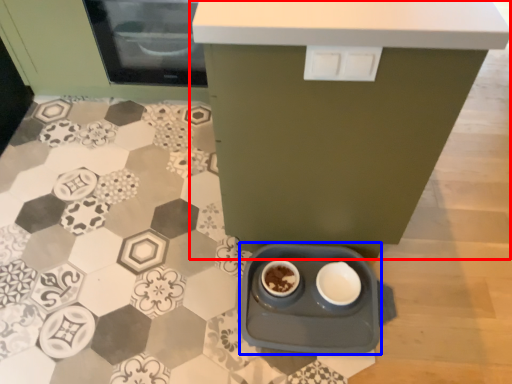
Question: Which object is closer to the camera taking this photo, table (highlighted by a red box) or appliance (highlighted by a blue box)?

Choices:
 (A) table
 (B) appliance

Answer: (A)